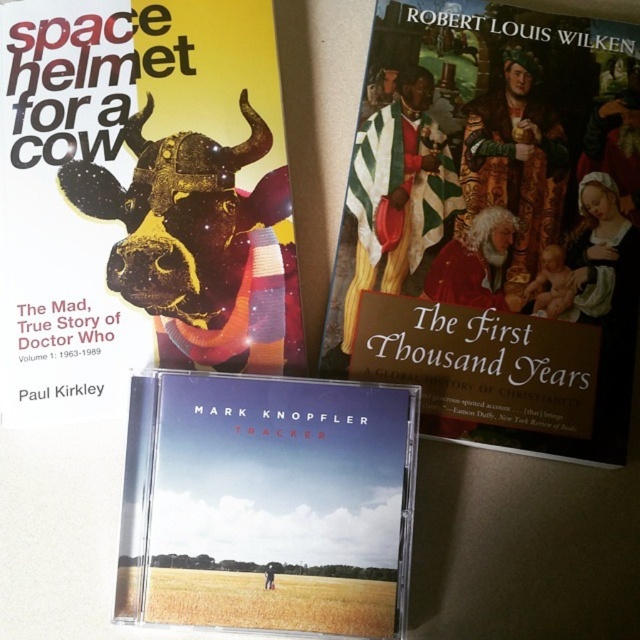
Question: Based on their relative distances, which object is farther from the matte cd case at center?

Choices:
 (A) metallic gold bull at center
 (B) matte black book cover at left
 (C) matte gold book at center

Answer: (C)

Question: Is matte gold book at center to the left of matte cd case at center from the viewer's perspective?

Choices:
 (A) yes
 (B) no

Answer: (B)

Question: Can you confirm if matte gold book at center is bigger than matte black book cover at left?

Choices:
 (A) no
 (B) yes

Answer: (B)

Question: Considering the relative positions of matte black book cover at left and matte cd case at center in the image provided, where is matte black book cover at left located with respect to matte cd case at center?

Choices:
 (A) below
 (B) above

Answer: (B)

Question: Which object is farther from the camera taking this photo?

Choices:
 (A) metallic gold bull at center
 (B) matte black book cover at left
 (C) matte cd case at center

Answer: (A)

Question: Which point is farther to the camera?

Choices:
 (A) (8, 324)
 (B) (336, 416)
 (C) (637, 209)

Answer: (C)